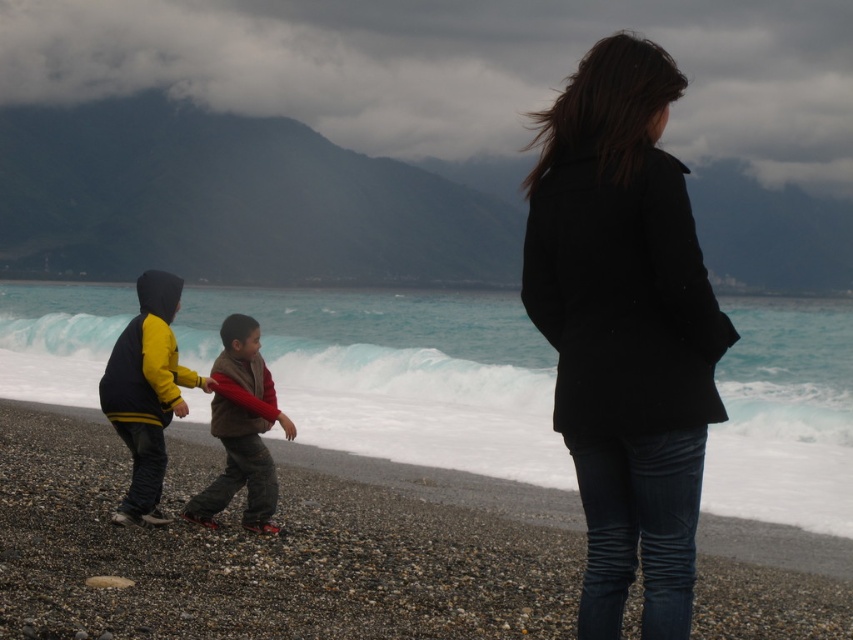
Question: Is yellow and black jacket at lower left to the right of brown fuzzy jacket at center from the viewer's perspective?

Choices:
 (A) no
 (B) yes

Answer: (A)

Question: Based on their relative distances, which object is nearer to the brown fuzzy jacket at center?

Choices:
 (A) yellow and black jacket at lower left
 (B) smooth pebbles at center
 (C) black matte coat at center

Answer: (A)

Question: Is smooth pebbles at center to the right of yellow and black jacket at lower left from the viewer's perspective?

Choices:
 (A) yes
 (B) no

Answer: (A)

Question: Which object is the closest to the yellow and black jacket at lower left?

Choices:
 (A) black matte coat at center
 (B) smooth pebbles at center

Answer: (B)

Question: Estimate the real-world distances between objects in this image. Which object is farther from the yellow and black jacket at lower left?

Choices:
 (A) brown fuzzy jacket at center
 (B) smooth pebbles at center
 (C) black matte coat at center

Answer: (C)

Question: Does smooth pebbles at center have a lesser width compared to yellow and black jacket at lower left?

Choices:
 (A) no
 (B) yes

Answer: (A)